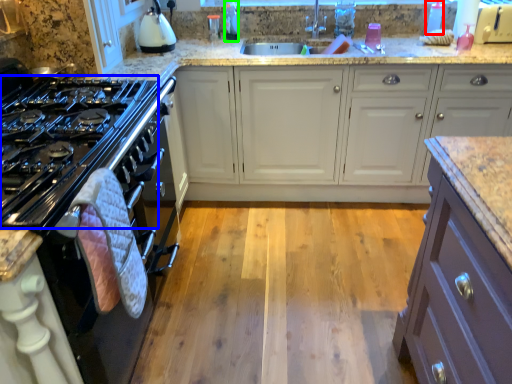
Question: Which object is the farthest from bottle (highlighted by a red box)? Choose among these: gas stove (highlighted by a blue box) or bottle (highlighted by a green box).

Choices:
 (A) gas stove
 (B) bottle

Answer: (A)